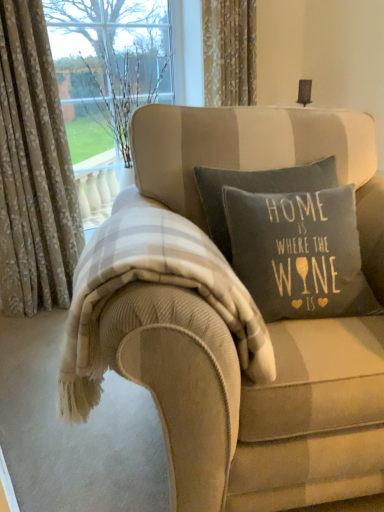
Question: Which direction should I rotate to face gold textured curtain at upper center, the first curtain in the right-to-left sequence, — up or down?

Choices:
 (A) down
 (B) up

Answer: (B)

Question: Is beige corduroy couch at center taller than dark gray cotton pillow at center?

Choices:
 (A) yes
 (B) no

Answer: (A)

Question: Can you confirm if beige corduroy couch at center is positioned to the right of dark gray cotton pillow at center?

Choices:
 (A) yes
 (B) no

Answer: (B)

Question: Is beige corduroy couch at center with dark gray cotton pillow at center?

Choices:
 (A) no
 (B) yes

Answer: (A)

Question: Is beige corduroy couch at center bigger than dark gray cotton pillow at center?

Choices:
 (A) yes
 (B) no

Answer: (A)

Question: Is dark gray cotton pillow at center a part of beige corduroy couch at center?

Choices:
 (A) no
 (B) yes

Answer: (B)

Question: Does beige corduroy couch at center turn towards dark gray cotton pillow at center?

Choices:
 (A) no
 (B) yes

Answer: (B)

Question: Does gold textured curtain at upper center, which is the 2th curtain from left to right, lie in front of dark gray cotton pillow at center?

Choices:
 (A) yes
 (B) no

Answer: (B)

Question: Is gold textured curtain at upper center, which is the 2th curtain from left to right, at the left side of dark gray cotton pillow at center?

Choices:
 (A) no
 (B) yes

Answer: (B)

Question: Is gold textured curtain at upper center, the first curtain in the right-to-left sequence, not close to dark gray cotton pillow at center?

Choices:
 (A) no
 (B) yes

Answer: (B)

Question: Can you confirm if gold textured curtain at upper center, which is the 2th curtain from left to right, is taller than dark gray cotton pillow at center?

Choices:
 (A) no
 (B) yes

Answer: (A)

Question: Is gold textured curtain at upper center, the first curtain in the right-to-left sequence, oriented away from dark gray cotton pillow at center?

Choices:
 (A) no
 (B) yes

Answer: (A)

Question: From a real-world perspective, is gold textured curtain at upper center, the first curtain in the right-to-left sequence, physically below dark gray cotton pillow at center?

Choices:
 (A) no
 (B) yes

Answer: (A)

Question: Can you confirm if dark gray cotton pillow at center is taller than plaid wool blanket at center?

Choices:
 (A) no
 (B) yes

Answer: (B)